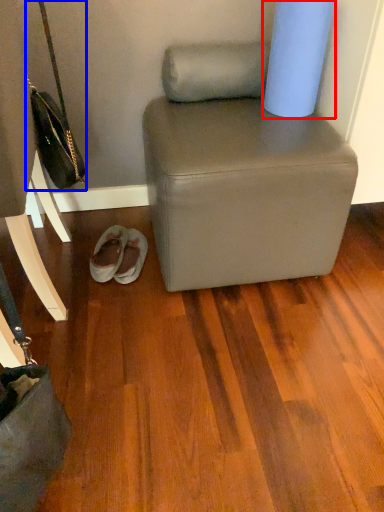
Question: Which of the following is the farthest to the observer, toilet paper (highlighted by a red box) or handbag (highlighted by a blue box)?

Choices:
 (A) toilet paper
 (B) handbag

Answer: (A)